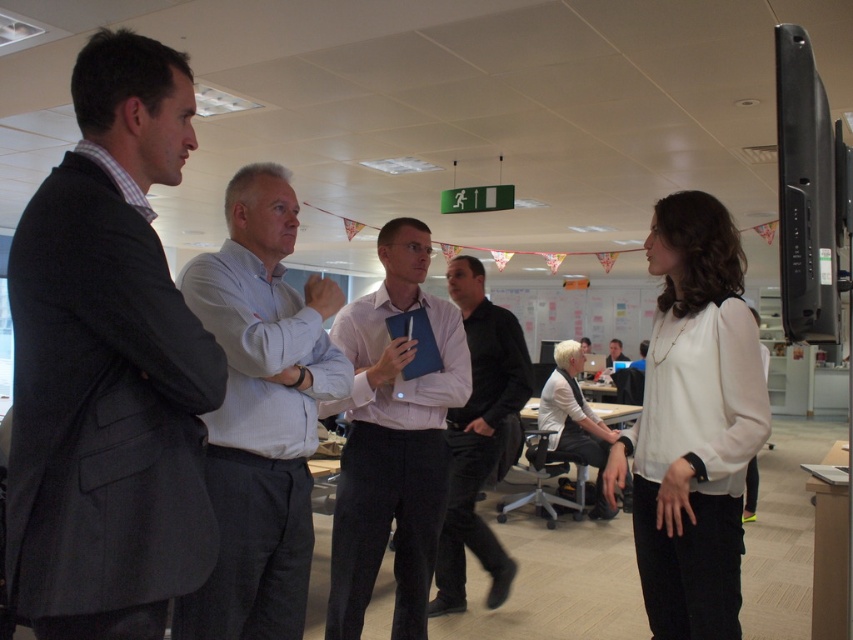
Is point (293, 209) positioned before point (613, 344)?

Yes, point (293, 209) is closer to viewer.

You are a GUI agent. You are given a task and a screenshot of the screen. Output one action in this format:
    pyautogui.click(x=<x>, y=<y>)
    Task: Click on the white shirt at center
    
    Given the screenshot: What is the action you would take?
    pyautogui.click(x=260, y=413)

Consider the image. Between dark gray suit at left and white shirt at center, which one has less height?

dark gray suit at left is shorter.

Is point (94, 339) positioned in front of point (294, 204)?

That is True.

Is point (125, 208) behind point (231, 468)?

No, (125, 208) is closer to viewer.

In order to click on dark gray suit at left in this screenshot , I will do `click(108, 365)`.

Is white shirt at center to the right of white matte blouse at center from the viewer's perspective?

No, white shirt at center is not to the right of white matte blouse at center.

The height and width of the screenshot is (640, 853). What do you see at coordinates (260, 413) in the screenshot? I see `white shirt at center` at bounding box center [260, 413].

Locate an element on the screen. The width and height of the screenshot is (853, 640). white shirt at center is located at coordinates (260, 413).